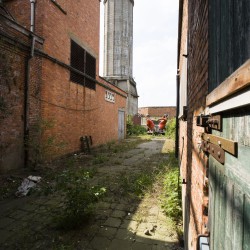
Find the location of a particular element. The image size is (250, 250). cable is located at coordinates (55, 105).